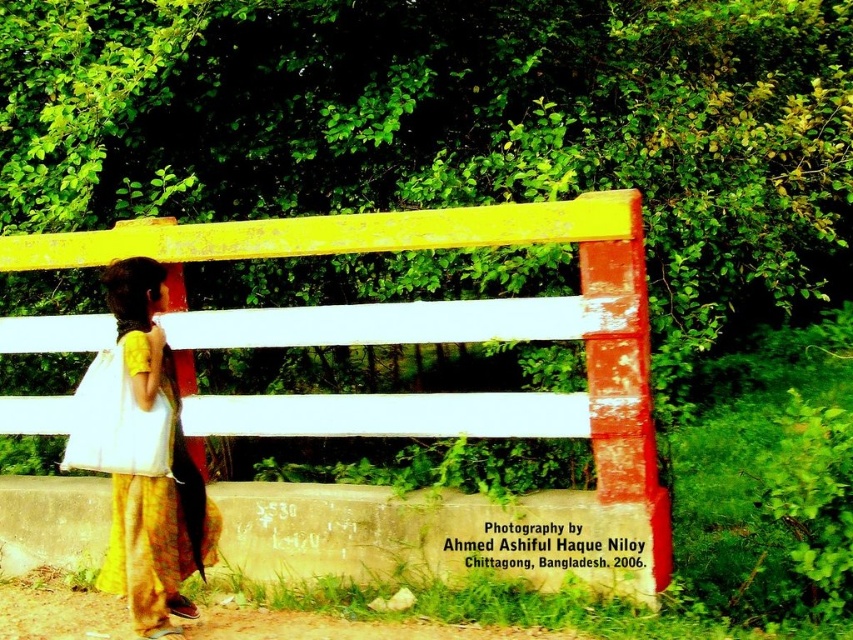
Question: Is yellow painted wood fence at center positioned at the back of yellow cotton dress at left?

Choices:
 (A) yes
 (B) no

Answer: (A)

Question: Which of the following is the closest to the observer?

Choices:
 (A) yellow cotton dress at left
 (B) yellow painted wood fence at center

Answer: (A)

Question: Can you confirm if yellow painted wood fence at center is positioned to the left of yellow cotton dress at left?

Choices:
 (A) yes
 (B) no

Answer: (B)

Question: Is yellow painted wood fence at center positioned behind yellow cotton dress at left?

Choices:
 (A) yes
 (B) no

Answer: (A)